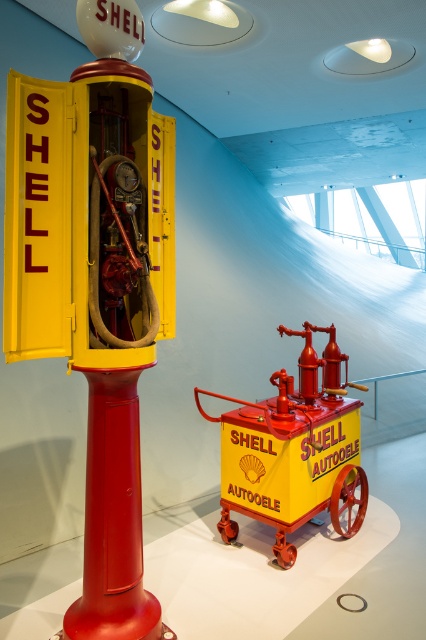
From the picture: You are a museum visitor and want to take a photo of both the metallic yellow fire truck at center and the matte yellow cart at center. Since you want both to be clearly visible in the frame, which object should you place closer to the camera to ensure the smaller one isn

The metallic yellow fire truck at center is smaller than the matte yellow cart at center. To ensure both are clearly visible in the photo, you should place the metallic yellow fire truck at center closer to the camera so its size in the frame matches the matte yellow cart at center.

What are the coordinates of the metallic yellow fire truck at center?

The metallic yellow fire truck at center is located at coordinates point (95,282).